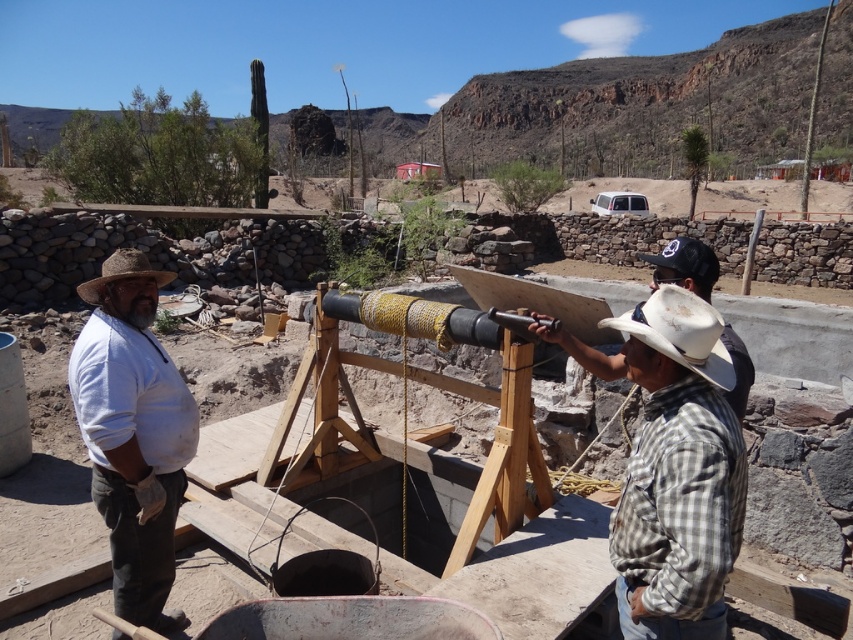
You are a safety inspector at the construction site. You need to check the distance between the two workers wearing the white matte cowboy hat at right and the brown straw cowboy hat at left. Which worker is closer to you?

The white matte cowboy hat at right is closer to the viewer than the brown straw cowboy hat at left, so the worker wearing the white matte cowboy hat at right is closer to you.

You are a safety inspector at the construction site. You need to ensure that all hard hats are properly worn. The safety regulation states that the hard hat must be at least 15 cm tall to comply with safety standards. The white matte cowboy hat at right and the brown straw cowboy hat at left are both being worn by workers. Which worker, if any, is violating the safety regulation based on the height of their hat?

The white matte cowboy hat at right is shorter than the brown straw cowboy hat at left. Since the regulation requires hats to be at least 15 cm tall, if the white matte cowboy hat at right is below 15 cm, then the worker wearing it is violating the regulation. However, without specific measurements, we can only conclude that the worker with the white matte cowboy hat at right might be noncompliant if their hat is under the required height.

You are standing at the construction site and need to reach a tool located at point (346, 435). Your robot has a maximum reach of 4 meters. Can the robot retrieve the tool?

The distance between point (346, 435) and the viewer is 4.39 meters, which exceeds the robot s maximum reach of 4 meters. The robot cannot retrieve the tool.